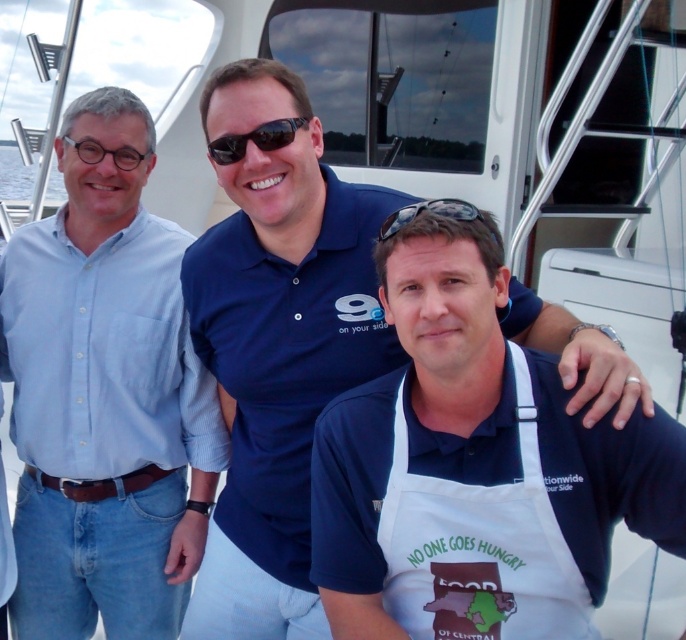
Between white fabric apron at center and black reflective sunglasses at center, which one is positioned higher?

black reflective sunglasses at center is higher up.

Identify the location of white fabric apron at center. The image size is (686, 640). (480, 547).

This screenshot has height=640, width=686. Find the location of `white fabric apron at center`. white fabric apron at center is located at coordinates (480, 547).

Is black reflective sunglasses at center wider than black plastic sunglasses at center?

In fact, black reflective sunglasses at center might be narrower than black plastic sunglasses at center.

Describe the element at coordinates (255, 140) in the screenshot. I see `black reflective sunglasses at center` at that location.

Identify the location of black reflective sunglasses at center. (255, 140).

Between white apron at center and black reflective sunglasses at center, which one has less height?

Standing shorter between the two is black reflective sunglasses at center.

Is point (449, 362) farther from viewer compared to point (294, 138)?

No, (449, 362) is closer to viewer.

Between point (504, 380) and point (279, 144), which one is positioned behind?

Point (279, 144)

Find the location of a particular element. white apron at center is located at coordinates (473, 467).